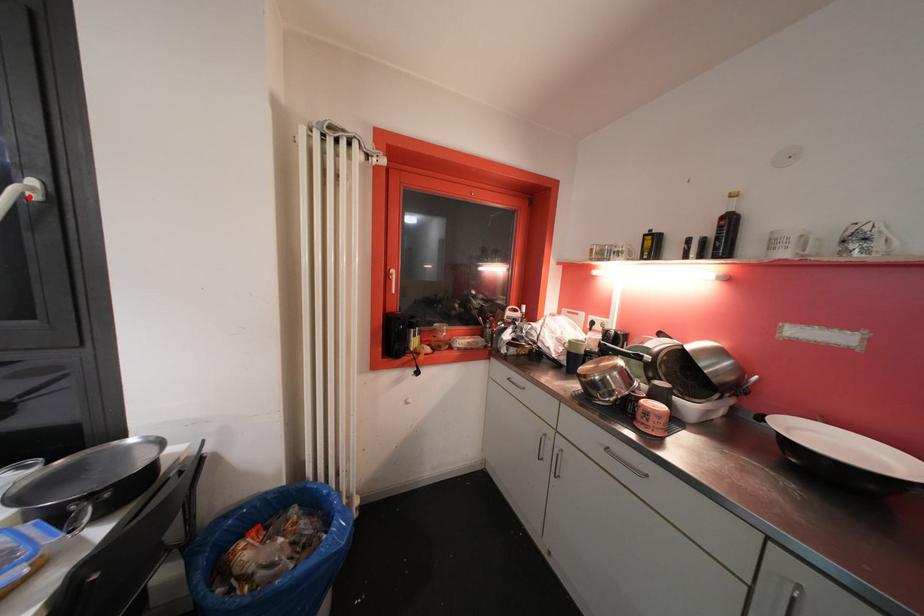
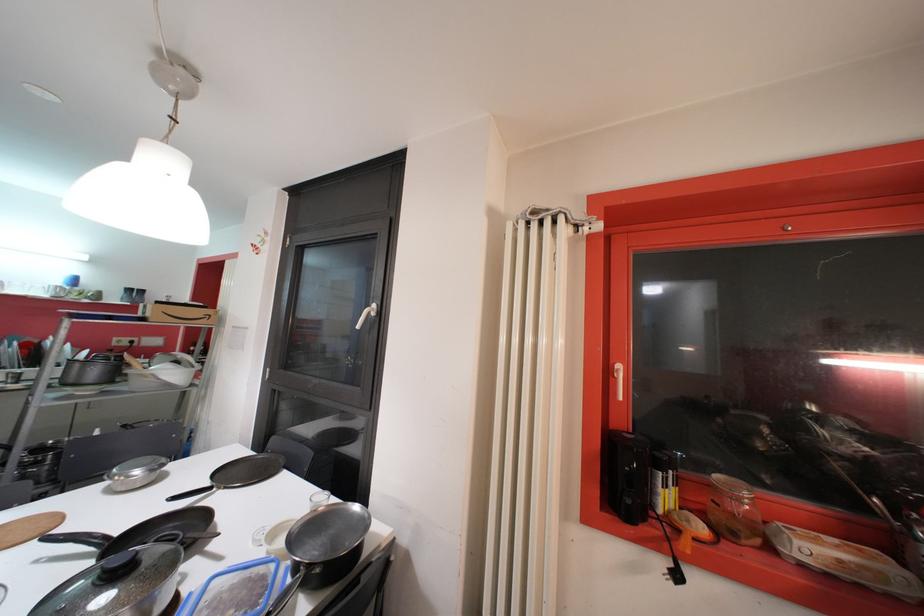
In the second image, find the point that corresponds to the highlighted location in the first image.

(373, 315)